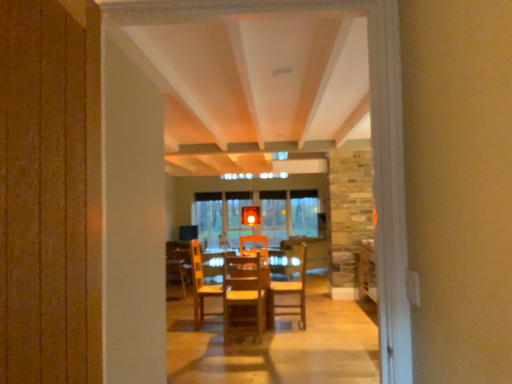
Question: Is wooden chair at center, the 2th chair positioned from the right, spatially inside wooden chairs at center, or outside of it?

Choices:
 (A) inside
 (B) outside

Answer: (B)

Question: From their relative heights in the image, would you say wooden chair at center, which is counted as the first chair, starting from the front, is taller or shorter than wooden chairs at center?

Choices:
 (A) short
 (B) tall

Answer: (B)

Question: Estimate the real-world distances between objects in this image. Which object is farther from the wooden table at center?

Choices:
 (A) wooden armchair at center
 (B) wooden chairs at center
 (C) wooden chair at center, the first chair positioned from the back
 (D) wooden chair at center, which ranks as the 2th chair in back-to-front order

Answer: (B)

Question: Which of these objects is positioned closest to the wooden chairs at center?

Choices:
 (A) wooden table at center
 (B) wooden armchair at center
 (C) wooden chair at center, the first chair positioned from the right
 (D) wooden chair at center, which is counted as the first chair, starting from the front

Answer: (D)